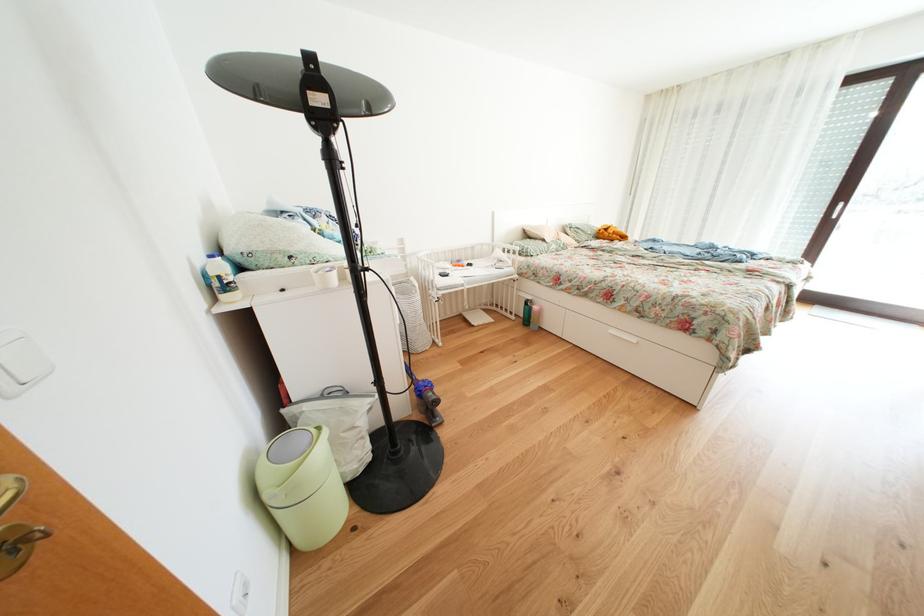
Find where to turn the glass door handle. Please return your answer as a coordinate pair (x, y).

(10, 490)